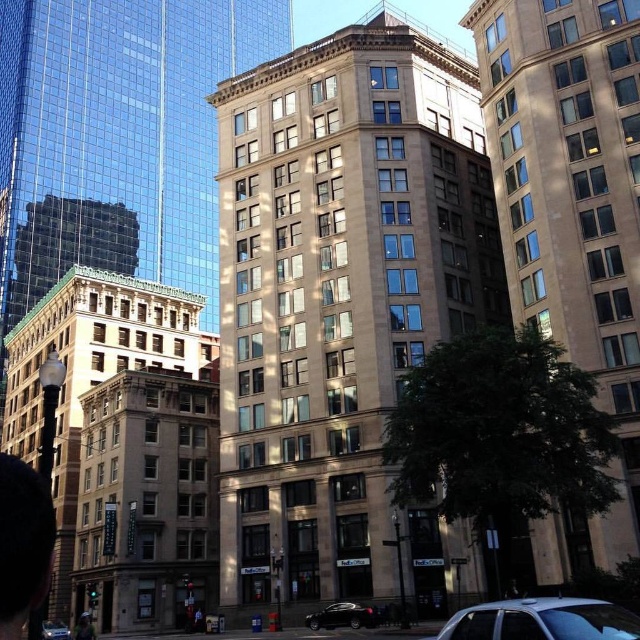
Who is lower down, silver metallic car at lower right or shiny black sedan at lower center?

shiny black sedan at lower center is below.

Can you confirm if silver metallic car at lower right is bigger than shiny black sedan at lower center?

Yes.

You are a GUI agent. You are given a task and a screenshot of the screen. Output one action in this format:
    pyautogui.click(x=<x>, y=<y>)
    Task: Click on the silver metallic car at lower right
    
    Given the screenshot: What is the action you would take?
    pyautogui.click(x=541, y=620)

Find the location of a particular element. The image size is (640, 640). silver metallic car at lower right is located at coordinates (541, 620).

Between point (515, 608) and point (68, 632), which one is positioned in front?

Point (515, 608)

Between silver metallic car at lower right and silver metallic sedan at lower left, which one appears on the right side from the viewer's perspective?

silver metallic car at lower right

Does point (598, 632) come closer to viewer compared to point (44, 628)?

Yes, point (598, 632) is in front of point (44, 628).

The height and width of the screenshot is (640, 640). In order to click on silver metallic car at lower right in this screenshot , I will do `click(541, 620)`.

Does shiny black sedan at lower center lie behind silver metallic sedan at lower left?

That is False.

Is shiny black sedan at lower center bigger than silver metallic sedan at lower left?

No, shiny black sedan at lower center is not bigger than silver metallic sedan at lower left.

Locate an element on the screen. This screenshot has width=640, height=640. shiny black sedan at lower center is located at coordinates (342, 616).